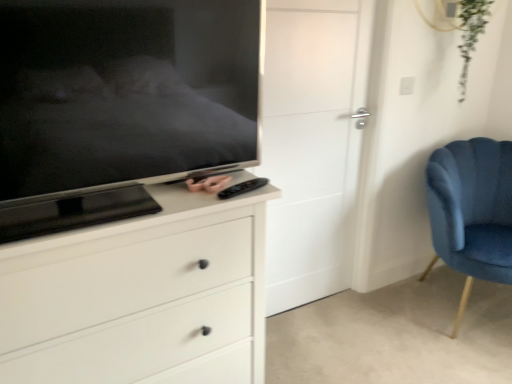
Find the location of `space that is in front of pink matte remote control at center`. space that is in front of pink matte remote control at center is located at coordinates (188, 205).